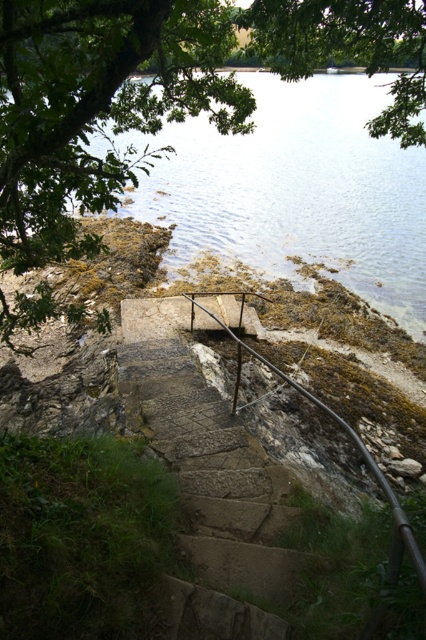
You are standing at the top of the stone steps looking down towards the shoreline. You notice a green leafy tree at upper left and a rusty metal railing at center. Which object is higher in the image?

The green leafy tree at upper left is higher than the rusty metal railing at center in the image.

You are standing at the bottom of the stone steps and looking up. Which green leafy tree is closer to your left side? The green leafy tree at upper left or the green leafy tree at upper center?

The green leafy tree at upper left is closer to your left side because it is positioned to the left of the green leafy tree at upper center.